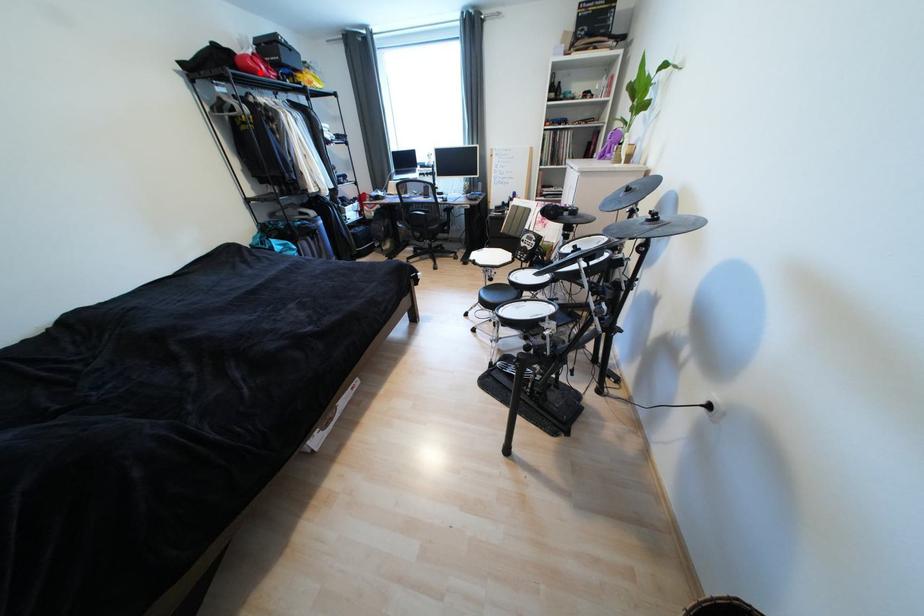
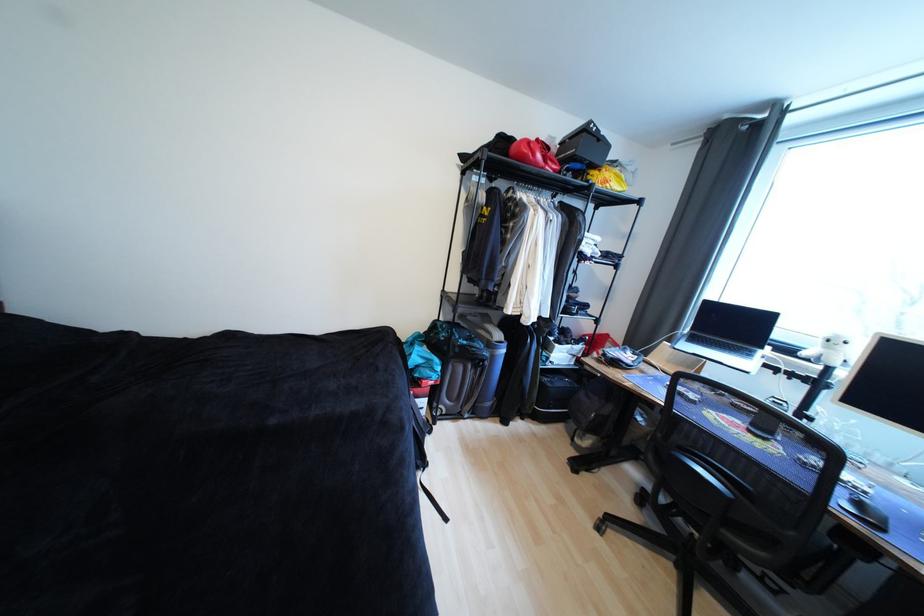
Find the pixel in the second image that matches the highlighted location in the first image.

(529, 159)